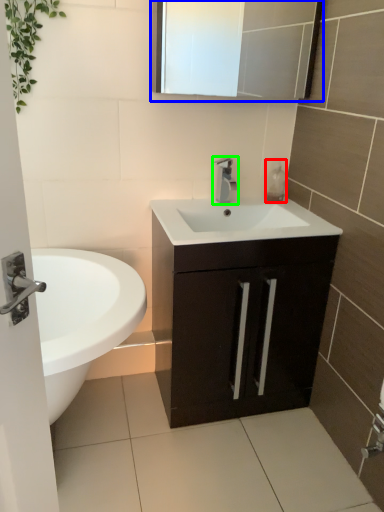
Question: Based on their relative distances, which object is nearer to soap dispenser (highlighted by a red box)? Choose from medicine cabinet (highlighted by a blue box) and tap (highlighted by a green box).

Choices:
 (A) medicine cabinet
 (B) tap

Answer: (B)